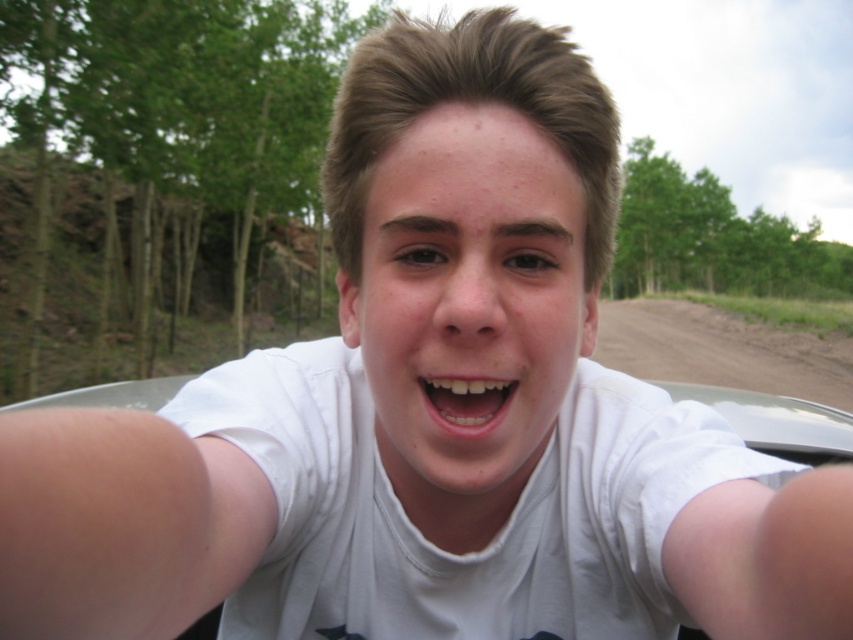
Which is more to the right, white cotton t-shirt at center or brown dirt track at lower right?

brown dirt track at lower right

Is point (618, 538) closer to viewer compared to point (796, 387)?

Yes, point (618, 538) is in front of point (796, 387).

Locate an element on the screen. This screenshot has width=853, height=640. white cotton t-shirt at center is located at coordinates (495, 536).

Is brown dirt track at lower right below white glossy teeth at center?

No.

Does point (740, 369) come closer to viewer compared to point (445, 380)?

No, (740, 369) is further to viewer.

I want to click on brown dirt track at lower right, so click(x=722, y=349).

The width and height of the screenshot is (853, 640). Identify the location of brown dirt track at lower right. (722, 349).

Is point (293, 392) closer to viewer compared to point (456, 384)?

No, it is not.

Between point (595, 380) and point (463, 378), which one is positioned behind?

The point (595, 380) is behind.

This screenshot has height=640, width=853. Find the location of `white cotton t-shirt at center`. white cotton t-shirt at center is located at coordinates (495, 536).